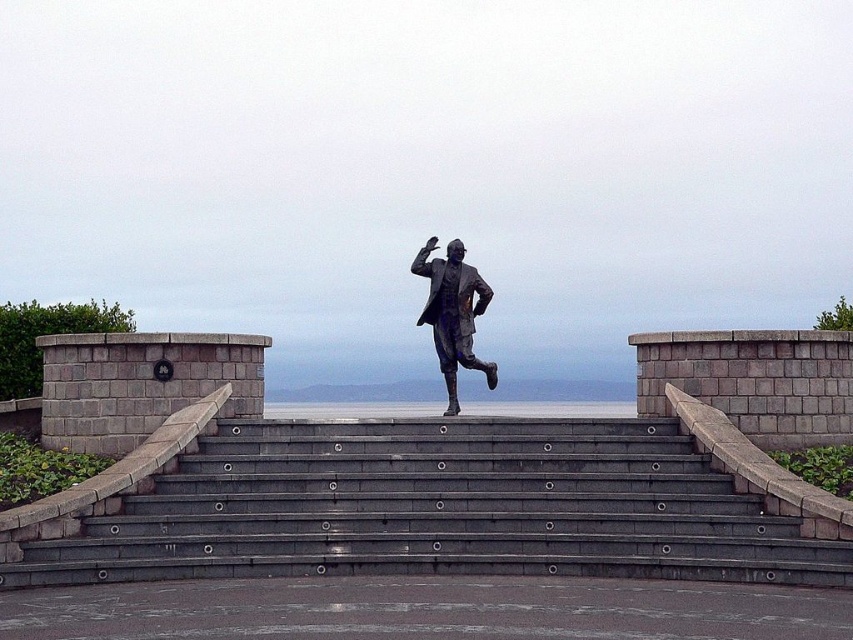
Question: Which object appears closest to the camera in this image?

Choices:
 (A) gray concrete stairs at center
 (B) bronze statue at center

Answer: (A)

Question: Among these points, which one is nearest to the camera?

Choices:
 (A) tap(451, 310)
 (B) tap(648, 497)

Answer: (B)

Question: Is gray concrete stairs at center bigger than bronze statue at center?

Choices:
 (A) no
 (B) yes

Answer: (B)

Question: Is gray concrete stairs at center further to the viewer compared to bronze statue at center?

Choices:
 (A) no
 (B) yes

Answer: (A)

Question: Is the position of gray concrete stairs at center more distant than that of bronze statue at center?

Choices:
 (A) no
 (B) yes

Answer: (A)